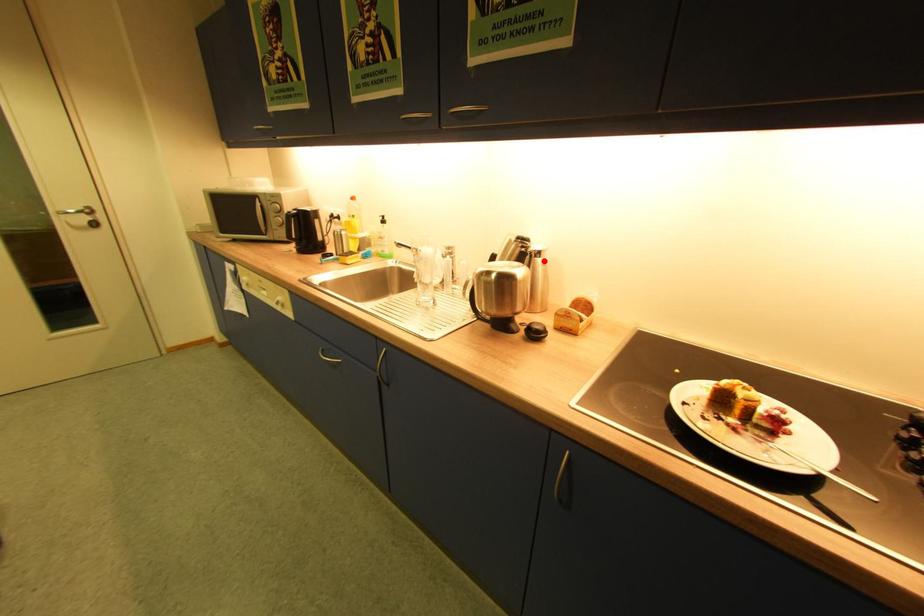
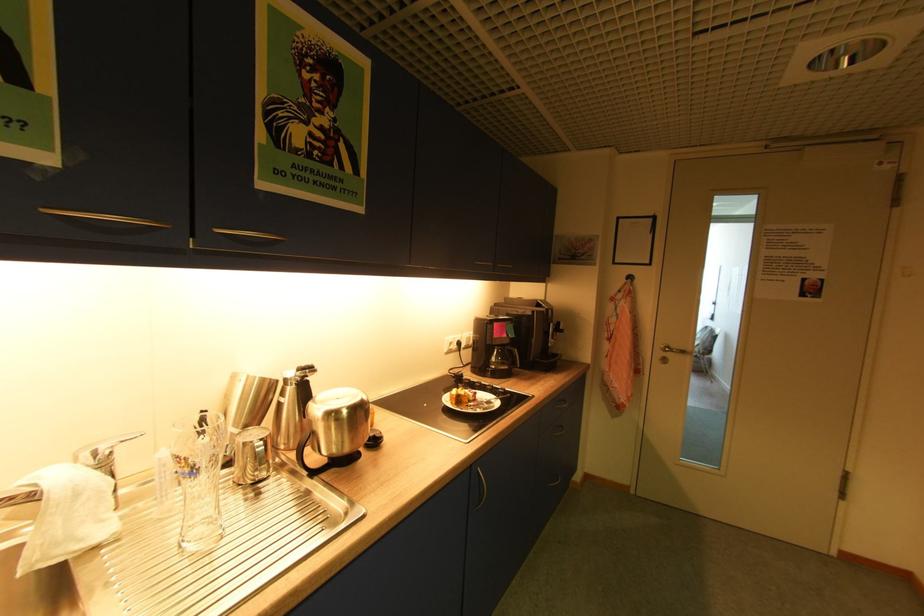
Question: I am providing you with two images of the same scene from different viewpoints. A red point is marked on the first image. At the location where the point appears in image 1, is it still visible in image 2?

Choices:
 (A) Yes
 (B) No

Answer: (A)